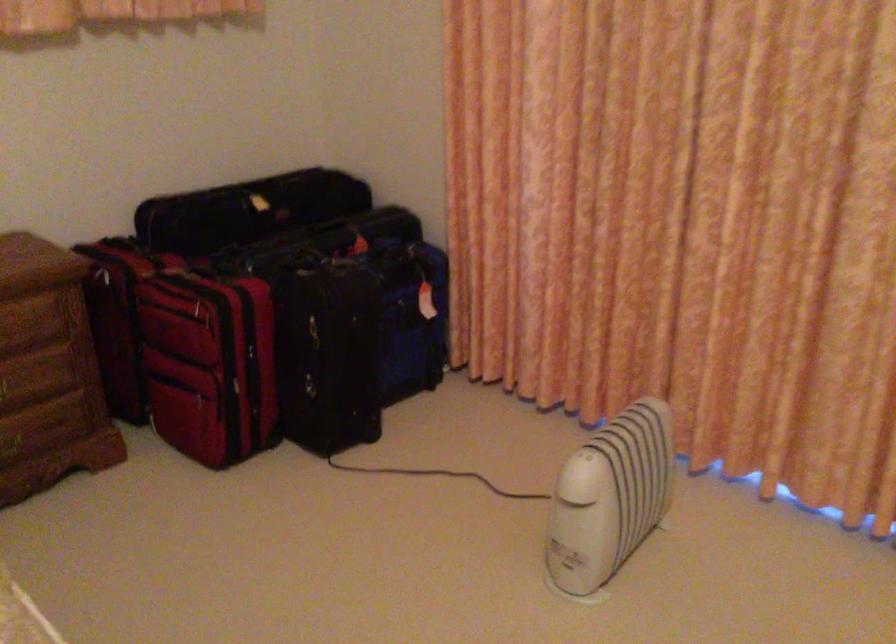
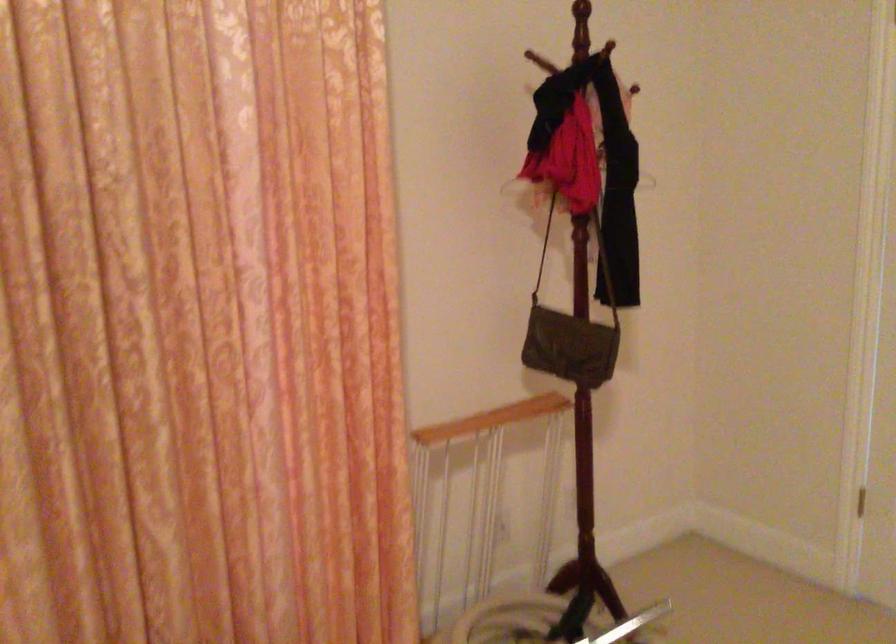
Question: How did the camera likely rotate?

Choices:
 (A) Left
 (B) Right
 (C) Up
 (D) Down

Answer: (B)